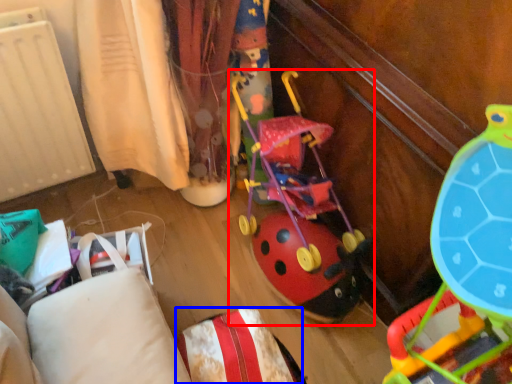
Question: Which object is closer to the camera taking this photo, toy (highlighted by a red box) or pillow (highlighted by a blue box)?

Choices:
 (A) toy
 (B) pillow

Answer: (B)